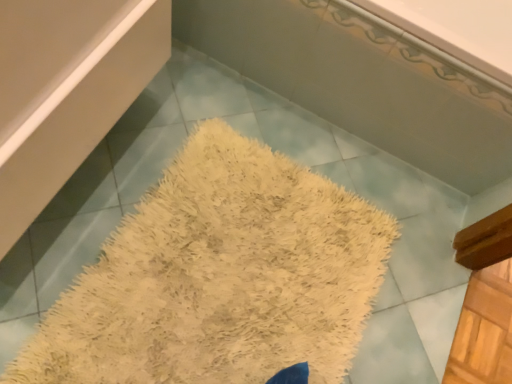
Question: Does white fluffy bath mat at center have a greater height compared to white shaggy rug at center?

Choices:
 (A) no
 (B) yes

Answer: (A)

Question: From the image's perspective, is white fluffy bath mat at center above white shaggy rug at center?

Choices:
 (A) yes
 (B) no

Answer: (B)

Question: From a real-world perspective, does white fluffy bath mat at center stand above white shaggy rug at center?

Choices:
 (A) no
 (B) yes

Answer: (A)

Question: Are white fluffy bath mat at center and white shaggy rug at center located far from each other?

Choices:
 (A) no
 (B) yes

Answer: (A)

Question: From a real-world perspective, is white fluffy bath mat at center located beneath white shaggy rug at center?

Choices:
 (A) no
 (B) yes

Answer: (B)

Question: Considering the relative sizes of white fluffy bath mat at center and white shaggy rug at center in the image provided, is white fluffy bath mat at center shorter than white shaggy rug at center?

Choices:
 (A) no
 (B) yes

Answer: (B)

Question: From the image's perspective, does white shaggy rug at center appear higher than white fluffy bath mat at center?

Choices:
 (A) no
 (B) yes

Answer: (B)

Question: Is white shaggy rug at center to the left of white fluffy bath mat at center from the viewer's perspective?

Choices:
 (A) no
 (B) yes

Answer: (A)

Question: Is white shaggy rug at center thinner than white fluffy bath mat at center?

Choices:
 (A) no
 (B) yes

Answer: (B)

Question: From the image's perspective, is white shaggy rug at center beneath white fluffy bath mat at center?

Choices:
 (A) yes
 (B) no

Answer: (B)

Question: Is white shaggy rug at center closer to the viewer compared to white fluffy bath mat at center?

Choices:
 (A) yes
 (B) no

Answer: (B)

Question: Is white shaggy rug at center to the right of white fluffy bath mat at center from the viewer's perspective?

Choices:
 (A) no
 (B) yes

Answer: (B)

Question: Is point (304, 238) positioned closer to the camera than point (371, 82)?

Choices:
 (A) closer
 (B) farther

Answer: (B)